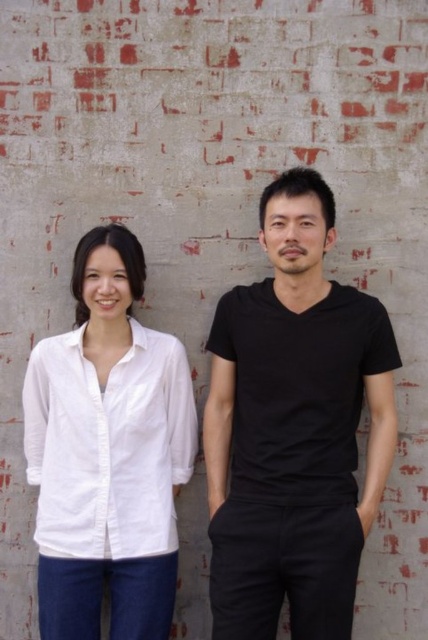
Is the position of black matte t-shirt at center more distant than that of white cotton shirt at left?

That is False.

Who is taller, black matte t-shirt at center or white cotton shirt at left?

Answer: black matte t-shirt at center

Which is behind, point (389, 465) or point (133, 374)?

Positioned behind is point (133, 374).

I want to click on black matte t-shirt at center, so click(x=294, y=428).